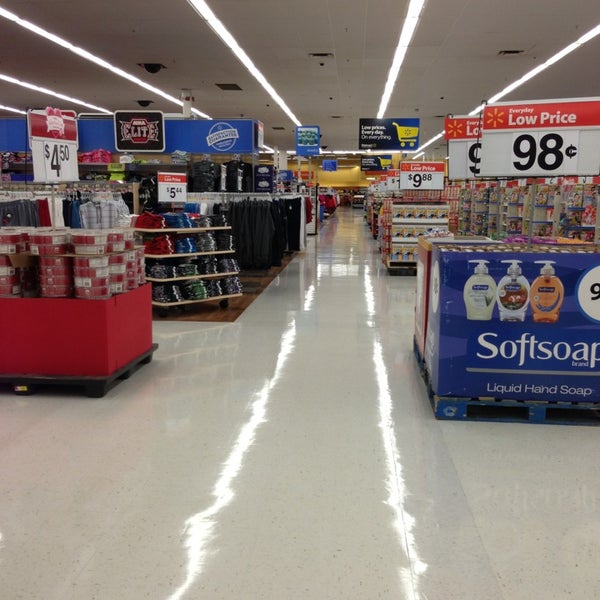
The image size is (600, 600). I want to click on soap, so click(497, 292).